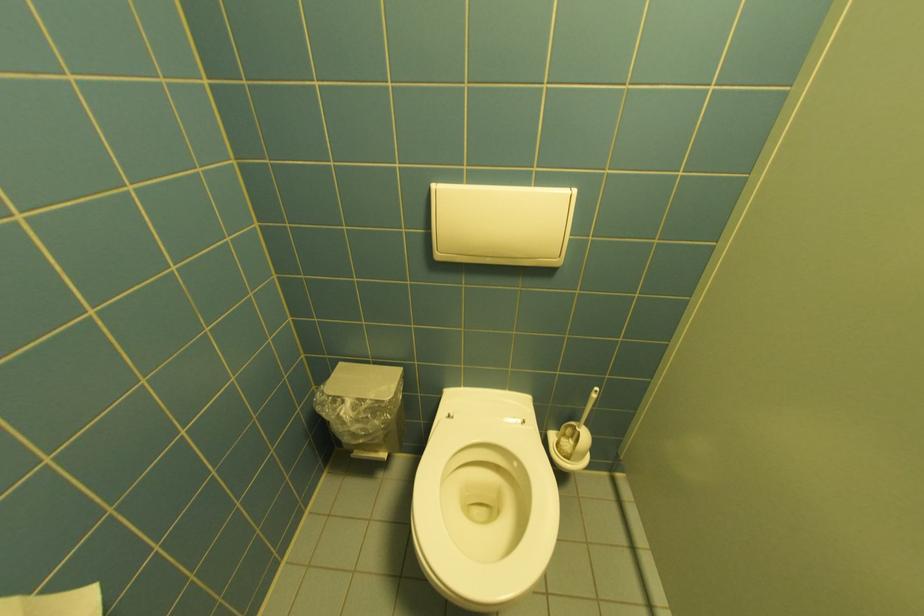
Find where to lift the white toilet seat. Please return your answer as a coordinate pair (x, y).

(483, 500)